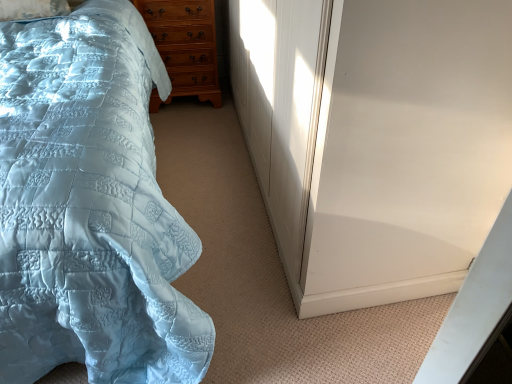
Question: From the image's perspective, is white glossy screen door at right under light brown wooden chest of drawers at upper left?

Choices:
 (A) yes
 (B) no

Answer: (A)

Question: Can you confirm if white glossy screen door at right is wider than light brown wooden chest of drawers at upper left?

Choices:
 (A) no
 (B) yes

Answer: (B)

Question: Can you confirm if white glossy screen door at right is thinner than light brown wooden chest of drawers at upper left?

Choices:
 (A) yes
 (B) no

Answer: (B)

Question: From the image's perspective, does white glossy screen door at right appear higher than light brown wooden chest of drawers at upper left?

Choices:
 (A) no
 (B) yes

Answer: (A)

Question: Does white glossy screen door at right have a larger size compared to light brown wooden chest of drawers at upper left?

Choices:
 (A) no
 (B) yes

Answer: (B)

Question: Could you tell me if white glossy screen door at right is facing light brown wooden chest of drawers at upper left?

Choices:
 (A) no
 (B) yes

Answer: (B)

Question: Considering the relative sizes of light blue quilted bed at left and light brown wooden chest of drawers at upper left in the image provided, is light blue quilted bed at left thinner than light brown wooden chest of drawers at upper left?

Choices:
 (A) no
 (B) yes

Answer: (A)

Question: Is light blue quilted bed at left bigger than light brown wooden chest of drawers at upper left?

Choices:
 (A) no
 (B) yes

Answer: (B)

Question: Does light blue quilted bed at left touch light brown wooden chest of drawers at upper left?

Choices:
 (A) yes
 (B) no

Answer: (B)

Question: Is light blue quilted bed at left completely or partially outside of light brown wooden chest of drawers at upper left?

Choices:
 (A) yes
 (B) no

Answer: (A)

Question: Can you confirm if light blue quilted bed at left is wider than light brown wooden chest of drawers at upper left?

Choices:
 (A) yes
 (B) no

Answer: (A)

Question: Can you confirm if light blue quilted bed at left is shorter than light brown wooden chest of drawers at upper left?

Choices:
 (A) yes
 (B) no

Answer: (B)

Question: Is white glossy screen door at right positioned far away from light blue quilted bed at left?

Choices:
 (A) no
 (B) yes

Answer: (A)